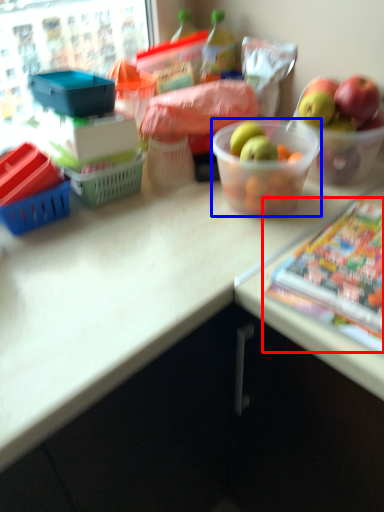
Question: Which of the following is the closest to the observer, comic book (highlighted by a red box) or bowl (highlighted by a blue box)?

Choices:
 (A) comic book
 (B) bowl

Answer: (A)